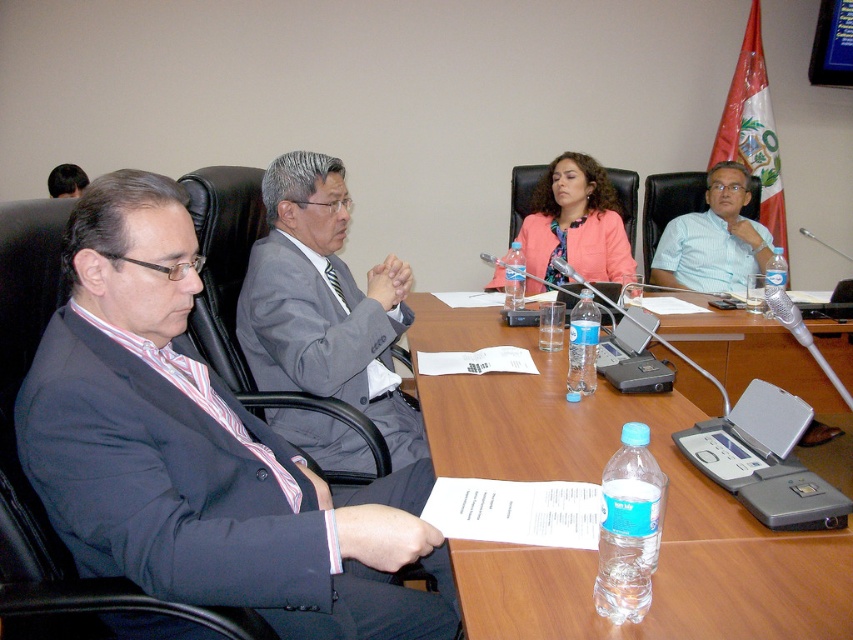
Does gray suit at center lie in front of clear plastic bottle at center?

Yes, gray suit at center is in front of clear plastic bottle at center.

Measure the distance between gray suit at center and camera.

A distance of 1.72 meters exists between gray suit at center and camera.

In order to click on gray suit at center in this screenshot , I will do tap(323, 305).

Where is `gray suit at center`? Image resolution: width=853 pixels, height=640 pixels. gray suit at center is located at coordinates (323, 305).

Who is positioned more to the right, matte black suit at left or clear plastic bottle at center?

clear plastic bottle at center

Does point (215, 474) come behind point (514, 284)?

No, it is in front of (514, 284).

This screenshot has height=640, width=853. I want to click on matte black suit at left, so click(x=200, y=451).

Is light blue shirt at right to the right of clear plastic bottle at center from the viewer's perspective?

Yes, light blue shirt at right is to the right of clear plastic bottle at center.

The width and height of the screenshot is (853, 640). What do you see at coordinates (712, 237) in the screenshot?
I see `light blue shirt at right` at bounding box center [712, 237].

What do you see at coordinates (712, 237) in the screenshot? The height and width of the screenshot is (640, 853). I see `light blue shirt at right` at bounding box center [712, 237].

Where is `light blue shirt at right`? light blue shirt at right is located at coordinates (712, 237).